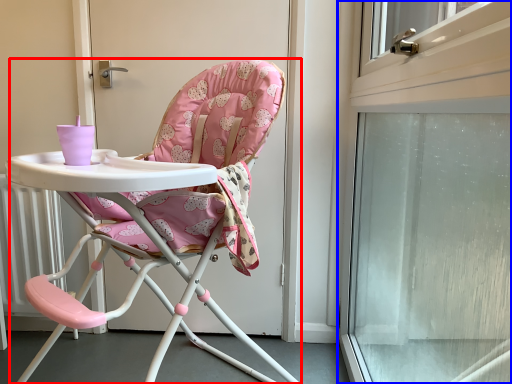
Question: Which object appears closest to the camera in this image, chair (highlighted by a red box) or screen door (highlighted by a blue box)?

Choices:
 (A) chair
 (B) screen door

Answer: (B)